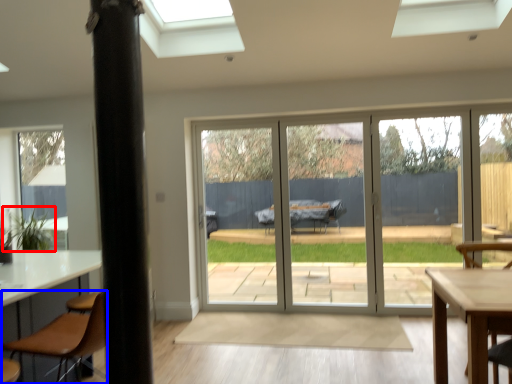
Question: Which object appears farthest to the camera in this image, plant (highlighted by a red box) or chair (highlighted by a blue box)?

Choices:
 (A) plant
 (B) chair

Answer: (A)